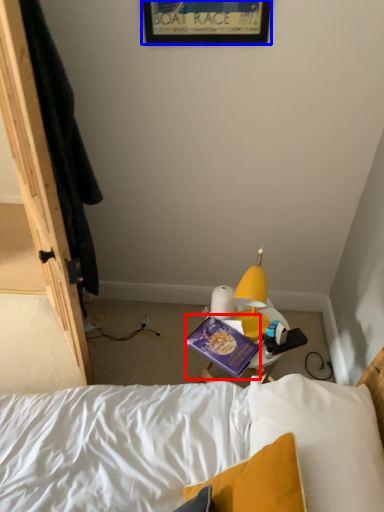
Question: Which object appears farthest to the camera in this image, paperback book (highlighted by a red box) or picture frame (highlighted by a blue box)?

Choices:
 (A) paperback book
 (B) picture frame

Answer: (A)